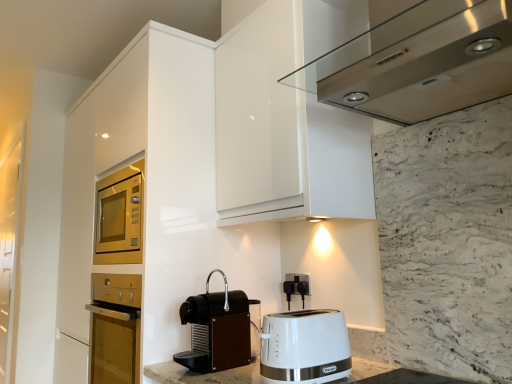
Question: Should I look upward or downward to see black plastic outlet at lower center?

Choices:
 (A) down
 (B) up

Answer: (A)

Question: Could you tell me if black matte coffee machine at lower center is facing satin stainless steel range hood at upper center?

Choices:
 (A) yes
 (B) no

Answer: (B)

Question: Is black matte coffee machine at lower center next to satin stainless steel range hood at upper center?

Choices:
 (A) no
 (B) yes

Answer: (A)

Question: Is black matte coffee machine at lower center in front of satin stainless steel range hood at upper center?

Choices:
 (A) no
 (B) yes

Answer: (A)

Question: Does black matte coffee machine at lower center lie behind satin stainless steel range hood at upper center?

Choices:
 (A) no
 (B) yes

Answer: (B)

Question: Considering the relative sizes of black matte coffee machine at lower center and satin stainless steel range hood at upper center in the image provided, is black matte coffee machine at lower center taller than satin stainless steel range hood at upper center?

Choices:
 (A) no
 (B) yes

Answer: (A)

Question: Can you confirm if black matte coffee machine at lower center is positioned to the right of satin stainless steel range hood at upper center?

Choices:
 (A) yes
 (B) no

Answer: (B)

Question: Is satin stainless steel range hood at upper center thinner than black plastic outlet at lower center?

Choices:
 (A) no
 (B) yes

Answer: (A)

Question: Is satin stainless steel range hood at upper center positioned in front of black plastic outlet at lower center?

Choices:
 (A) yes
 (B) no

Answer: (A)

Question: Considering the relative sizes of satin stainless steel range hood at upper center and black plastic outlet at lower center in the image provided, is satin stainless steel range hood at upper center bigger than black plastic outlet at lower center?

Choices:
 (A) yes
 (B) no

Answer: (A)

Question: Is black plastic outlet at lower center located within satin stainless steel range hood at upper center?

Choices:
 (A) yes
 (B) no

Answer: (B)

Question: Is satin stainless steel range hood at upper center oriented away from black plastic outlet at lower center?

Choices:
 (A) no
 (B) yes

Answer: (A)

Question: Is satin stainless steel range hood at upper center shorter than black plastic outlet at lower center?

Choices:
 (A) no
 (B) yes

Answer: (A)

Question: Is satin stainless steel range hood at upper center wider than transparent glass door at left?

Choices:
 (A) no
 (B) yes

Answer: (A)